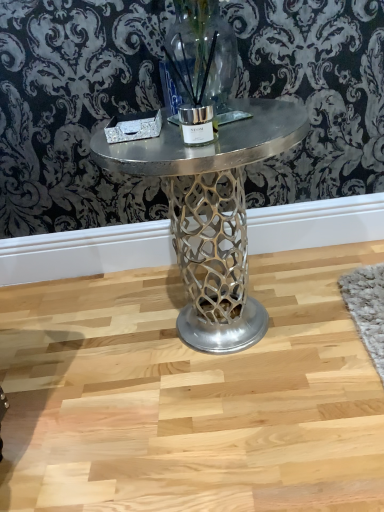
Question: Should I look upward or downward to see metallic silver table at center?

Choices:
 (A) up
 (B) down

Answer: (B)